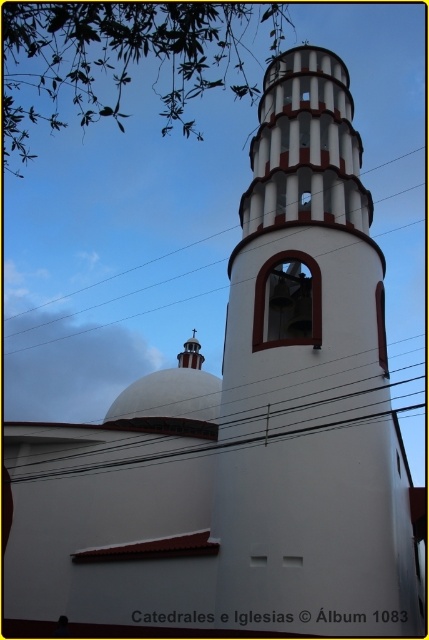
You are standing in front of the church and notice two points marked on the bell tower and dome. Which point, point (x=338, y=362) or point (x=422, y=451), is closer to you?

Point (x=338, y=362) is closer to the camera than point (x=422, y=451), so it is closer to you.

In the scene shown: You are standing in front of the church and notice the white smooth bell tower at center and the black wire at center. Which object is positioned to the left?

The black wire at center is positioned to the left of the white smooth bell tower at center.

You are standing in front of the church and notice the white smooth bell tower at center. Can you determine its exact position using the coordinate system provided?

The white smooth bell tower at center is located at point (310, 381).